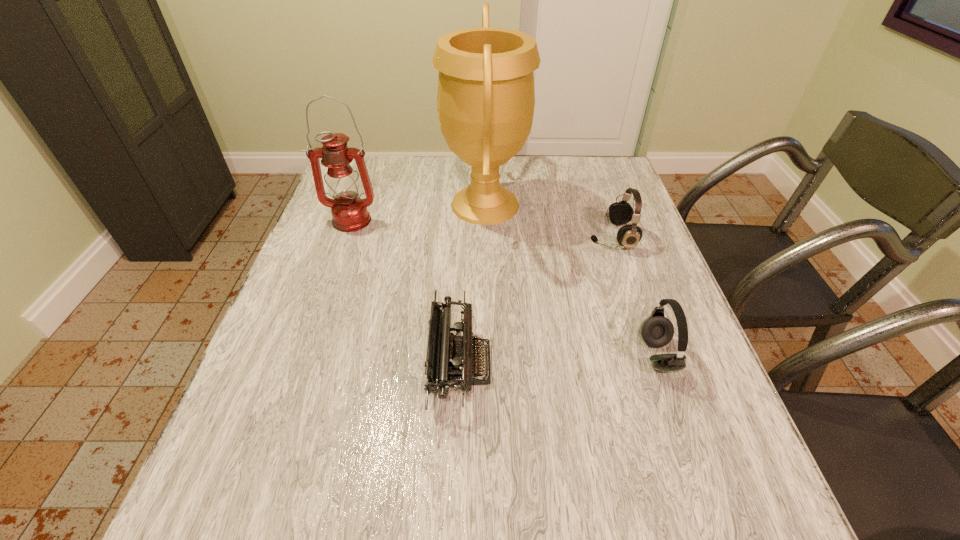
Identify the location of the tallest object. This screenshot has height=540, width=960. (486, 97).

Image resolution: width=960 pixels, height=540 pixels. In order to click on oil lamp in this screenshot , I will do `click(349, 212)`.

You are a GUI agent. You are given a task and a screenshot of the screen. Output one action in this format:
    pyautogui.click(x=<x>, y=<y>)
    Task: Click on the leftmost object
    This screenshot has width=960, height=540.
    Given the screenshot: What is the action you would take?
    pyautogui.click(x=349, y=212)

Identify the location of the farther headset. This screenshot has width=960, height=540. (620, 213).

The height and width of the screenshot is (540, 960). In order to click on the nearer headset in this screenshot , I will do `click(657, 331)`.

You are a GUI agent. You are given a task and a screenshot of the screen. Output one action in this format:
    pyautogui.click(x=<x>, y=<y>)
    Task: Click on the shortest object
    
    Given the screenshot: What is the action you would take?
    pyautogui.click(x=449, y=363)

At what (x,y) coordinates should I click in order to perform the action: click on free space located on the engravings side of the trophy. Please return your answer as a coordinate pair (x, y). The width and height of the screenshot is (960, 540). Looking at the image, I should click on (347, 205).

Where is `free space located on the engravings side of the trophy`? free space located on the engravings side of the trophy is located at coordinates (361, 205).

The height and width of the screenshot is (540, 960). In order to click on vacant area situated on the engravings side of the trophy in this screenshot , I will do `click(412, 205)`.

What are the coordinates of `vacant area situated 0.250m on the front of the fourth shortest object` in the screenshot? It's located at (324, 299).